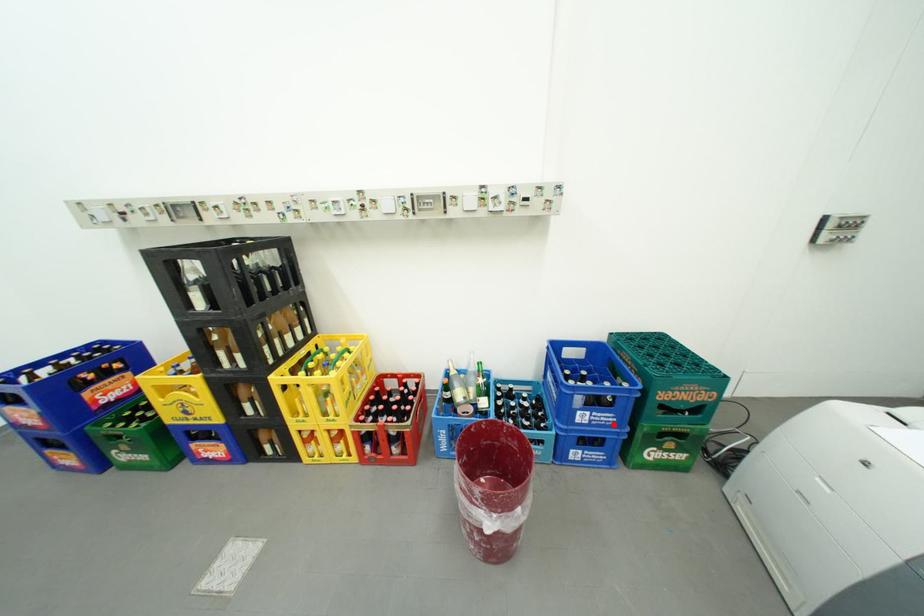
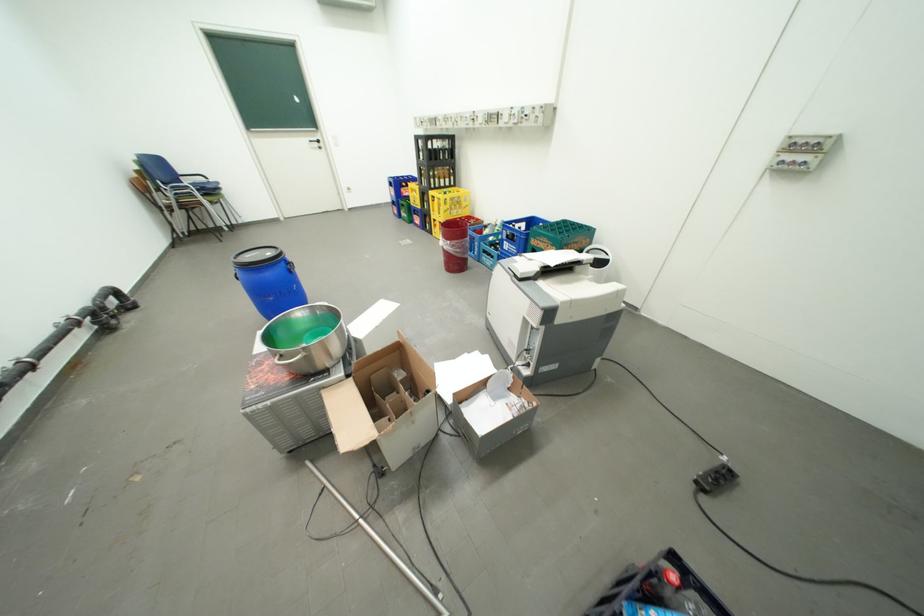
Where in the second image is the point corresponding to the highlighted location from the first image?

(523, 253)